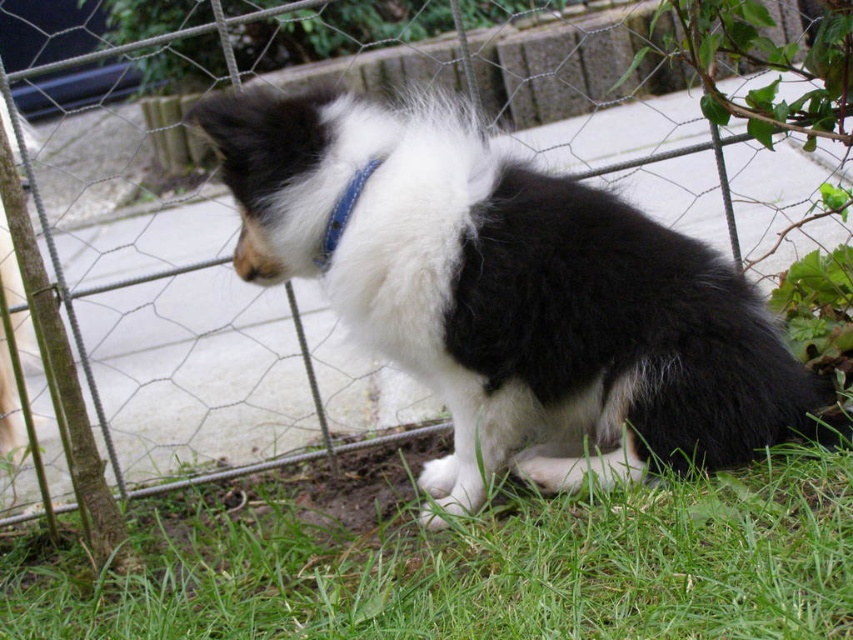
Is black and white fur at center to the left of green grass at lower right from the viewer's perspective?

In fact, black and white fur at center is to the right of green grass at lower right.

Does black and white fur at center have a smaller size compared to green grass at lower right?

Yes.

Which is behind, point (509, 413) or point (357, 566)?

The point (509, 413) is behind.

Locate an element on the screen. black and white fur at center is located at coordinates (509, 294).

Measure the distance between green grass at lower right and blue leather neckband at center.

The distance of green grass at lower right from blue leather neckband at center is 28.09 inches.

Does green grass at lower right appear on the right side of blue leather neckband at center?

Indeed, green grass at lower right is positioned on the right side of blue leather neckband at center.

This screenshot has height=640, width=853. I want to click on green grass at lower right, so click(462, 561).

Find the location of a particular element. green grass at lower right is located at coordinates (462, 561).

Which is behind, point (734, 282) or point (335, 237)?

The point (734, 282) is behind.

Based on the photo, which is more to the left, black and white fur at center or blue leather neckband at center?

From the viewer's perspective, blue leather neckband at center appears more on the left side.

Image resolution: width=853 pixels, height=640 pixels. Describe the element at coordinates (509, 294) in the screenshot. I see `black and white fur at center` at that location.

The height and width of the screenshot is (640, 853). Find the location of `black and white fur at center`. black and white fur at center is located at coordinates (509, 294).